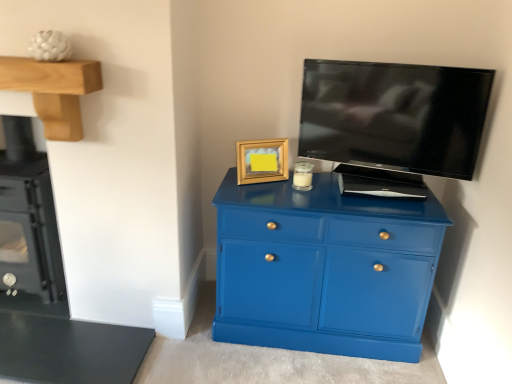
Locate an element on the screen. The width and height of the screenshot is (512, 384). vacant space in front of gold wooden picture frame at upper center is located at coordinates (268, 193).